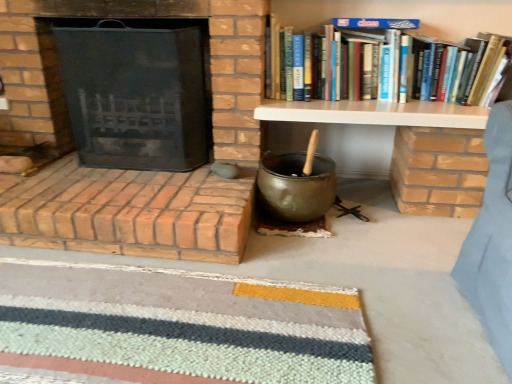
Question: Does striped wool doormat at lower center touch brick fireplace at left, the 1th fireplace in the bottom-to-top sequence?

Choices:
 (A) no
 (B) yes

Answer: (A)

Question: Does striped wool doormat at lower center have a greater width compared to brick fireplace at left, acting as the second fireplace starting from the top?

Choices:
 (A) no
 (B) yes

Answer: (A)

Question: Is brick fireplace at left, acting as the second fireplace starting from the top, surrounded by striped wool doormat at lower center?

Choices:
 (A) no
 (B) yes

Answer: (A)

Question: Considering the relative positions of striped wool doormat at lower center and brick fireplace at left, the 1th fireplace in the bottom-to-top sequence, in the image provided, is striped wool doormat at lower center to the right of brick fireplace at left, the 1th fireplace in the bottom-to-top sequence, from the viewer's perspective?

Choices:
 (A) yes
 (B) no

Answer: (A)

Question: Considering the relative sizes of striped wool doormat at lower center and brick fireplace at left, the 1th fireplace in the bottom-to-top sequence, in the image provided, is striped wool doormat at lower center bigger than brick fireplace at left, the 1th fireplace in the bottom-to-top sequence,?

Choices:
 (A) yes
 (B) no

Answer: (B)

Question: In terms of size, does white wood shelf at upper right appear bigger or smaller than striped wool doormat at lower center?

Choices:
 (A) big
 (B) small

Answer: (A)

Question: Is point (337, 109) closer or farther from the camera than point (316, 345)?

Choices:
 (A) farther
 (B) closer

Answer: (A)

Question: From a real-world perspective, is white wood shelf at upper right positioned above or below striped wool doormat at lower center?

Choices:
 (A) above
 (B) below

Answer: (A)

Question: Considering their positions, is white wood shelf at upper right located in front of or behind striped wool doormat at lower center?

Choices:
 (A) behind
 (B) front

Answer: (A)

Question: From the image's perspective, is black mesh fireplace screen at left, the second fireplace ordered from the bottom, located above or below white wood shelf at upper right?

Choices:
 (A) below
 (B) above

Answer: (B)

Question: From a real-world perspective, is black mesh fireplace screen at left, the 1th fireplace in the top-to-bottom sequence, physically located above or below white wood shelf at upper right?

Choices:
 (A) below
 (B) above

Answer: (B)

Question: Considering the positions of black mesh fireplace screen at left, the 1th fireplace in the top-to-bottom sequence, and white wood shelf at upper right in the image, is black mesh fireplace screen at left, the 1th fireplace in the top-to-bottom sequence, bigger or smaller than white wood shelf at upper right?

Choices:
 (A) big
 (B) small

Answer: (A)

Question: Would you say black mesh fireplace screen at left, the second fireplace ordered from the bottom, is inside or outside white wood shelf at upper right?

Choices:
 (A) inside
 (B) outside

Answer: (B)

Question: In the image, is brick fireplace at left, the 1th fireplace in the bottom-to-top sequence, on the left side or the right side of striped wool doormat at lower center?

Choices:
 (A) right
 (B) left

Answer: (B)

Question: From their relative heights in the image, would you say brick fireplace at left, the 1th fireplace in the bottom-to-top sequence, is taller or shorter than striped wool doormat at lower center?

Choices:
 (A) short
 (B) tall

Answer: (B)